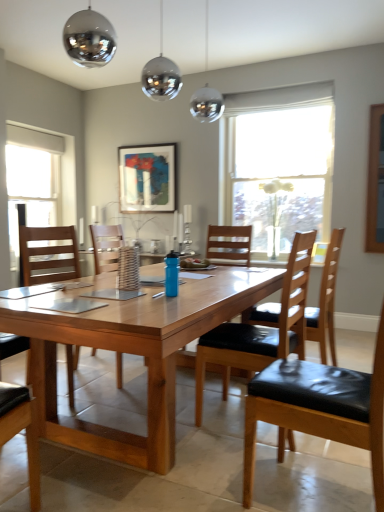
Question: Can you confirm if woven brown basket at center is thinner than white glass window at left, which ranks as the second window in right-to-left order?

Choices:
 (A) no
 (B) yes

Answer: (B)

Question: From the image's perspective, is woven brown basket at center located beneath white glass window at left, which ranks as the second window in right-to-left order?

Choices:
 (A) no
 (B) yes

Answer: (B)

Question: From a real-world perspective, does woven brown basket at center stand above white glass window at left, which ranks as the second window in right-to-left order?

Choices:
 (A) yes
 (B) no

Answer: (B)

Question: From a real-world perspective, is woven brown basket at center positioned under white glass window at left, the 1th window when ordered from left to right, based on gravity?

Choices:
 (A) yes
 (B) no

Answer: (A)

Question: Considering the relative sizes of woven brown basket at center and white glass window at left, which ranks as the second window in right-to-left order, in the image provided, is woven brown basket at center bigger than white glass window at left, which ranks as the second window in right-to-left order,?

Choices:
 (A) yes
 (B) no

Answer: (B)

Question: Is black leather chair at right, acting as the 3th chair starting from the left, in front of or behind white glass window at left, which ranks as the second window in right-to-left order, in the image?

Choices:
 (A) behind
 (B) front

Answer: (B)

Question: In the image, is black leather chair at right, acting as the 3th chair starting from the left, on the left side or the right side of white glass window at left, which ranks as the second window in right-to-left order?

Choices:
 (A) left
 (B) right

Answer: (B)

Question: Is black leather chair at right, acting as the 3th chair starting from the left, wider or thinner than white glass window at left, which ranks as the second window in right-to-left order?

Choices:
 (A) wide
 (B) thin

Answer: (A)

Question: From the image's perspective, is black leather chair at right, marked as the second chair in a right-to-left arrangement, above or below white glass window at left, which ranks as the second window in right-to-left order?

Choices:
 (A) above
 (B) below

Answer: (B)

Question: From a real-world perspective, is clear glass vase at center, which appears as the second window when viewed from the left, physically located above or below white glass window at left, the 1th window when ordered from left to right?

Choices:
 (A) above
 (B) below

Answer: (A)

Question: Which is correct: clear glass vase at center, placed as the first window when sorted from right to left, is inside white glass window at left, which ranks as the second window in right-to-left order, or outside of it?

Choices:
 (A) outside
 (B) inside

Answer: (A)

Question: Considering the positions of clear glass vase at center, placed as the first window when sorted from right to left, and white glass window at left, the 1th window when ordered from left to right, in the image, is clear glass vase at center, placed as the first window when sorted from right to left, taller or shorter than white glass window at left, the 1th window when ordered from left to right,?

Choices:
 (A) tall
 (B) short

Answer: (A)

Question: Considering the positions of clear glass vase at center, which appears as the second window when viewed from the left, and white glass window at left, the 1th window when ordered from left to right, in the image, is clear glass vase at center, which appears as the second window when viewed from the left, bigger or smaller than white glass window at left, the 1th window when ordered from left to right,?

Choices:
 (A) small
 (B) big

Answer: (B)

Question: Does point (317, 141) appear closer or farther from the camera than point (236, 326)?

Choices:
 (A) closer
 (B) farther

Answer: (B)

Question: Considering the relative positions of clear glass vase at center, which appears as the second window when viewed from the left, and black leather chair at center, arranged as the 3th chair when viewed from the right, in the image provided, is clear glass vase at center, which appears as the second window when viewed from the left, to the left or to the right of black leather chair at center, arranged as the 3th chair when viewed from the right,?

Choices:
 (A) left
 (B) right

Answer: (B)